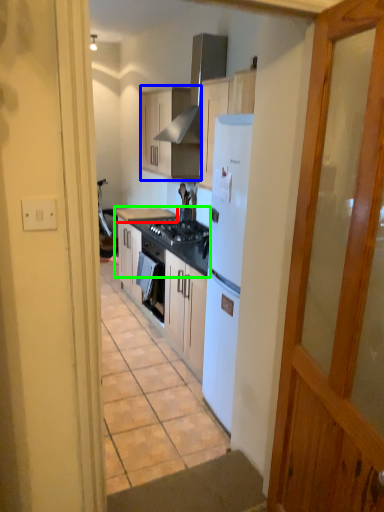
Question: Which object is the closest to the countertop (highlighted by a red box)? Choose among these: cabinetry (highlighted by a blue box) or countertop (highlighted by a green box).

Choices:
 (A) cabinetry
 (B) countertop

Answer: (B)